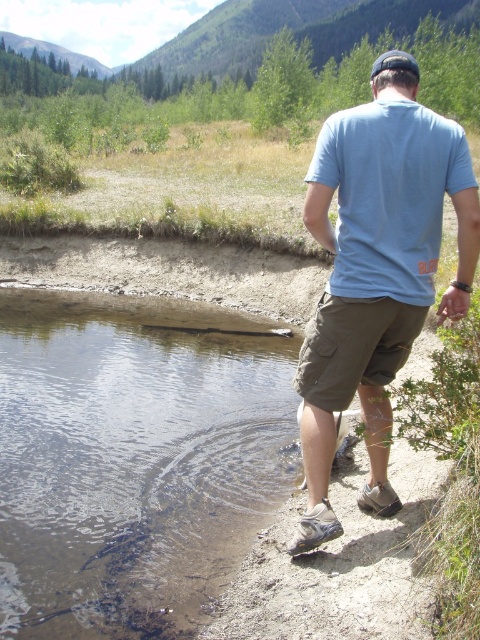
Question: Can you confirm if clear water at lower left is wider than khaki cotton shorts at lower center?

Choices:
 (A) no
 (B) yes

Answer: (B)

Question: Does clear water at lower left appear over light blue cotton t-shirt at back?

Choices:
 (A) no
 (B) yes

Answer: (A)

Question: Which object appears farthest from the camera in this image?

Choices:
 (A) clear water at lower left
 (B) light blue cotton t-shirt at back
 (C) light blue cotton shirt at upper right

Answer: (A)

Question: Which is farther from the light blue cotton t-shirt at back?

Choices:
 (A) clear water at lower left
 (B) light blue cotton shirt at upper right

Answer: (A)

Question: Among these objects, which one is nearest to the camera?

Choices:
 (A) khaki cotton shorts at lower center
 (B) light blue cotton shirt at upper right

Answer: (B)

Question: Can you confirm if clear water at lower left is bigger than light blue cotton shirt at upper right?

Choices:
 (A) yes
 (B) no

Answer: (B)